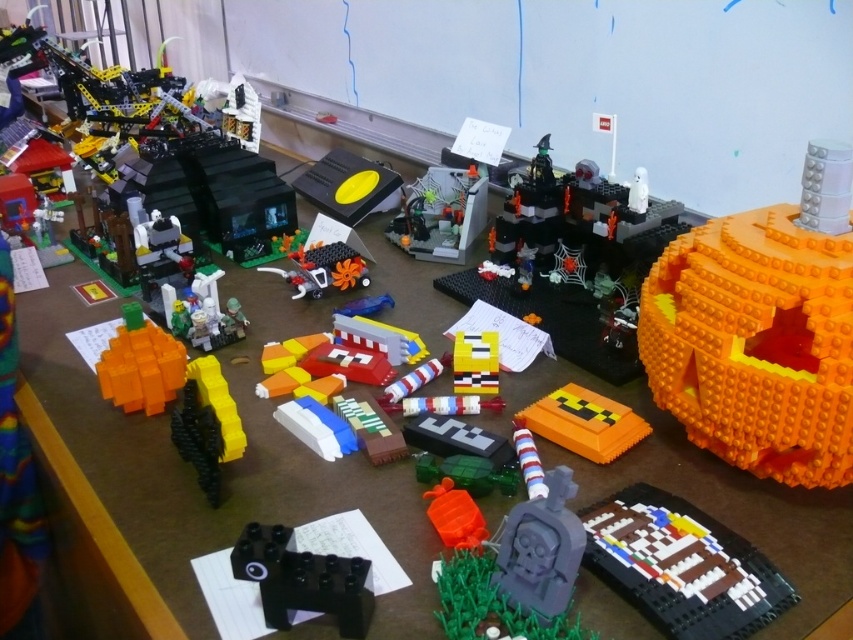
You are a visitor at a LEGO exhibition and want to take a photo of both the brown matte house at lower right and the shiny silver spaceship at center. Which object should you frame first in your camera viewfinder to ensure both are in the shot?

The brown matte house at lower right is positioned on the right side of the shiny silver spaceship at center, so you should frame the shiny silver spaceship at center first to ensure both are in the shot.

You are organizing a Halloween display and need to place the black matte block at lower left and orange matte pumpkin at lower left on a shelf. According to the scene, which object should be placed to the right side of the shelf?

The black matte block at lower left should be placed to the right side of the shelf because in the scene, the black matte block at lower left is to the right of the orange matte pumpkin at lower left.